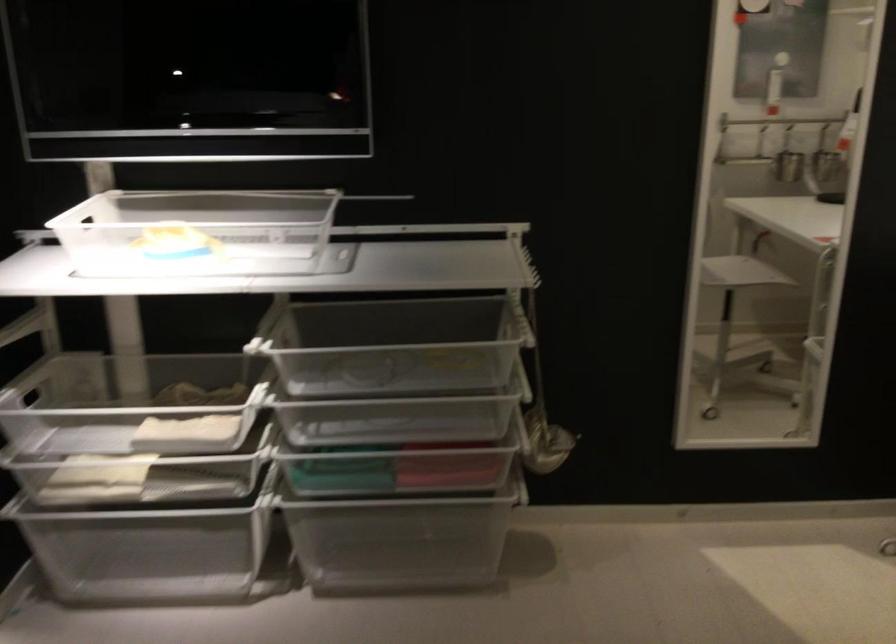
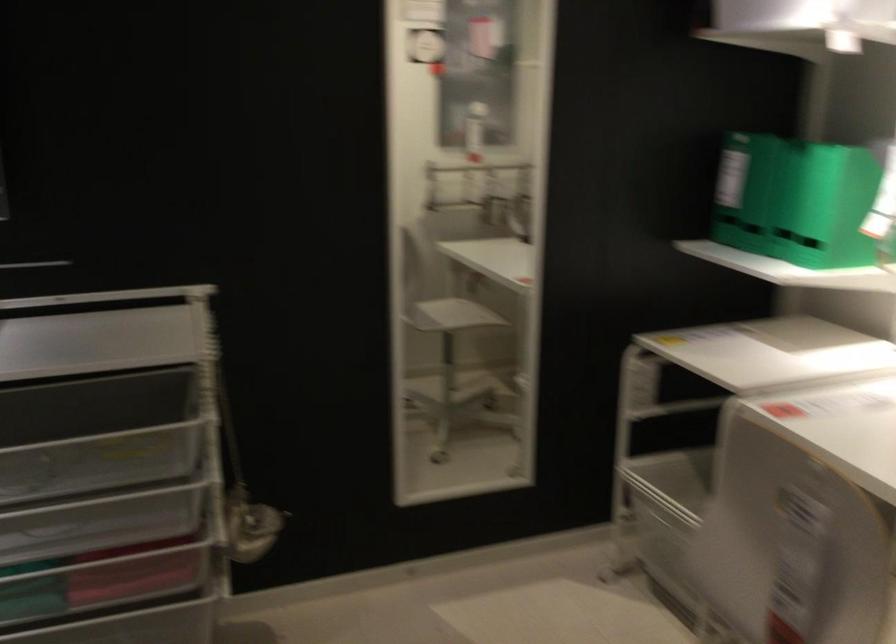
From the picture: Which direction would the cameraman need to move to produce the second image?

The cameraman walked toward right, forward.